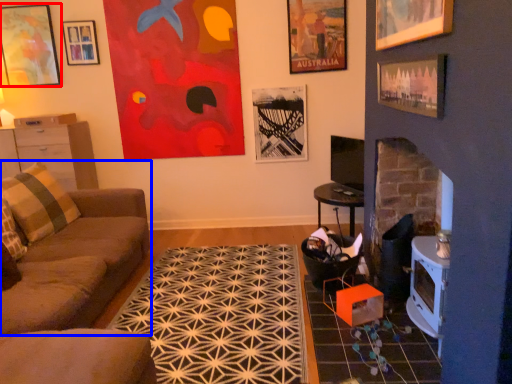
Question: Which of the following is the closest to the observer, picture frame (highlighted by a red box) or studio couch (highlighted by a blue box)?

Choices:
 (A) picture frame
 (B) studio couch

Answer: (B)